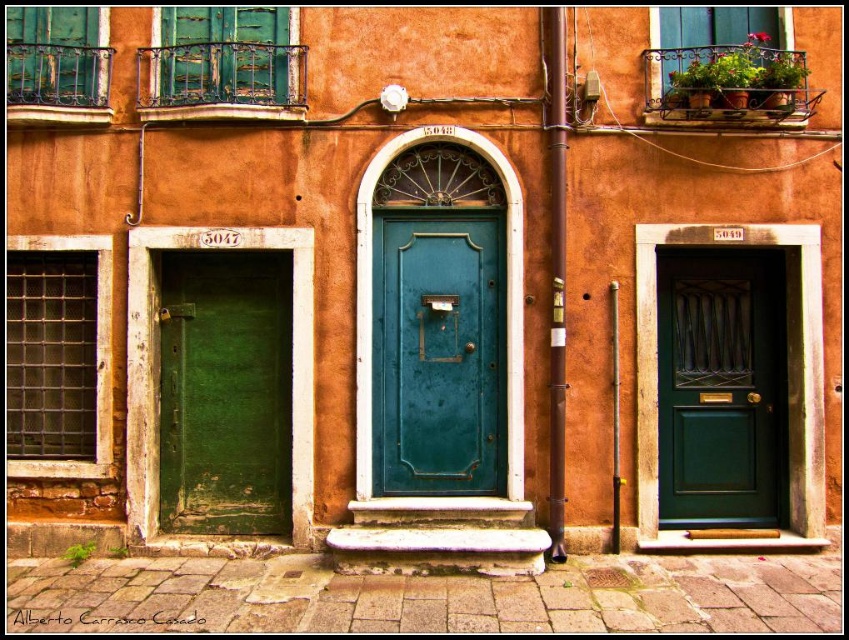
You are standing in front of the building and want to enter through the green matte door at left. However, you notice another green matte door at center. Which door is closer to your left side?

The green matte door at left is to the left of the green matte door at center, so it is closer to your left side.